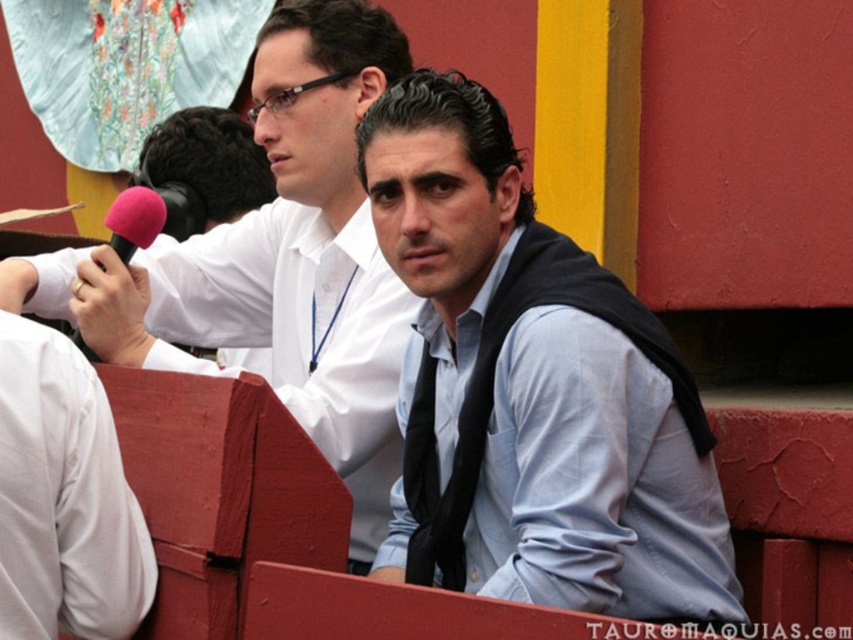
Question: Which point appears closest to the camera in this image?

Choices:
 (A) (126, 224)
 (B) (556, 275)
 (C) (323, 218)

Answer: (B)

Question: Which object is positioned closest to the pink fabric microphone at upper left?

Choices:
 (A) matte black tie at center
 (B) light blue shirt at center

Answer: (A)

Question: Is light blue shirt at center to the left of pink fabric microphone at upper left from the viewer's perspective?

Choices:
 (A) no
 (B) yes

Answer: (A)

Question: Which object is closer to the camera taking this photo?

Choices:
 (A) matte black tie at center
 (B) light blue shirt at center
 (C) pink fabric microphone at upper left

Answer: (B)

Question: Is light blue shirt at center to the left of matte black tie at center from the viewer's perspective?

Choices:
 (A) yes
 (B) no

Answer: (B)

Question: In this image, where is light blue shirt at center located relative to pink fabric microphone at upper left?

Choices:
 (A) above
 (B) below

Answer: (B)